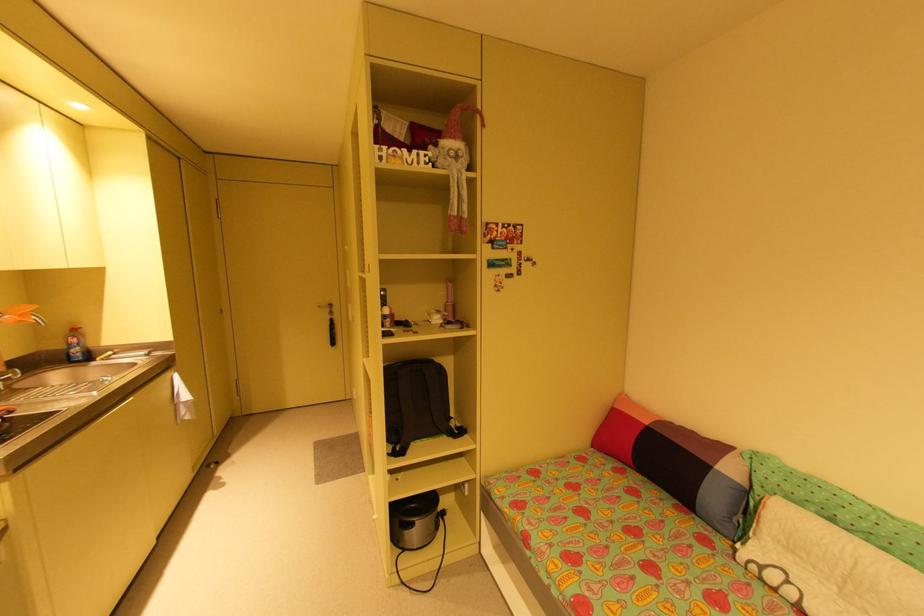
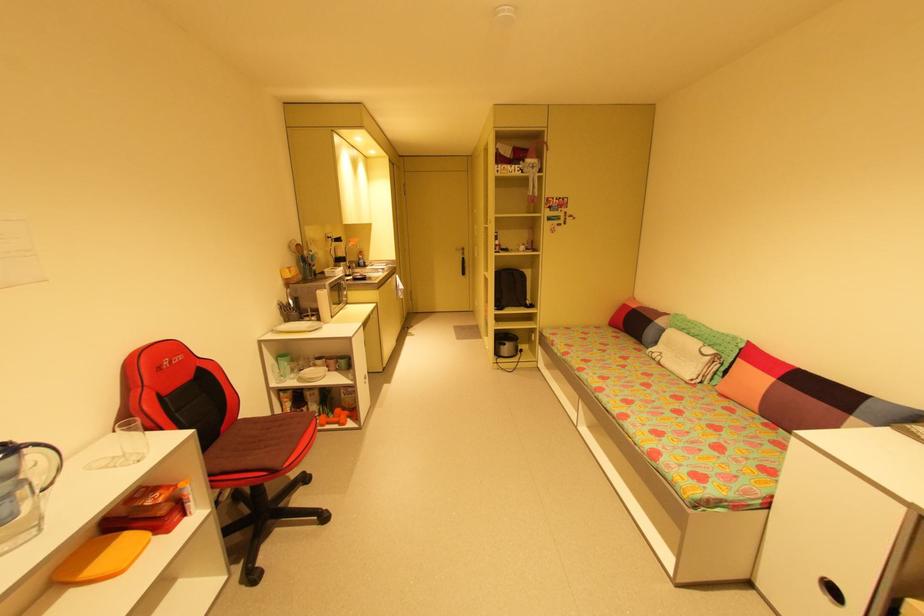
Locate, in the second image, the point that corresponds to (x=322, y=307) in the first image.

(460, 249)